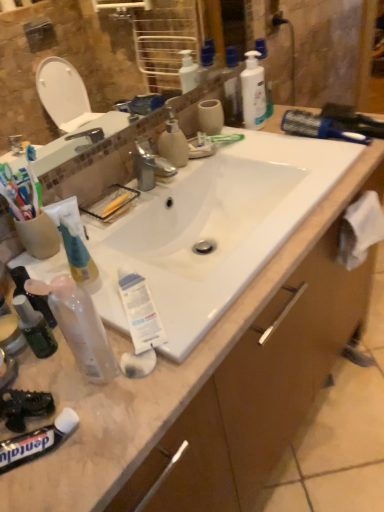
Question: Is white fabric at right inside or outside of brown wood drawer at lower right?

Choices:
 (A) inside
 (B) outside

Answer: (B)

Question: From the image's perspective, relative to brown wood drawer at lower right, is white fabric at right above or below?

Choices:
 (A) below
 (B) above

Answer: (B)

Question: Based on their relative distances, which object is nearer to the translucent plastic mouthwash at lower left?

Choices:
 (A) transparent plastic spray bottle at lower left, which is the first toiletry in left-to-right order
 (B) white fabric at right
 (C) black matte toothpaste at lower left, acting as the third toothpaste starting from the back
 (D) white matte tube at left, which appears as the first toothpaste when viewed from the top
 (E) translucent plastic bottles at upper center, acting as the 2th toiletry starting from the front

Answer: (A)

Question: Which object is the farthest from the black matte toothpaste at lower left, the 3th toothpaste when ordered from top to bottom?

Choices:
 (A) brown wood drawer at lower right
 (B) matte plastic soap dispenser at center, which is the 2th cleaning product in back-to-front order
 (C) white glossy bottle at upper right, positioned as the 2th cleaning product in bottom-to-top order
 (D) translucent plastic mouthwash at lower left
 (E) white fabric at right

Answer: (C)